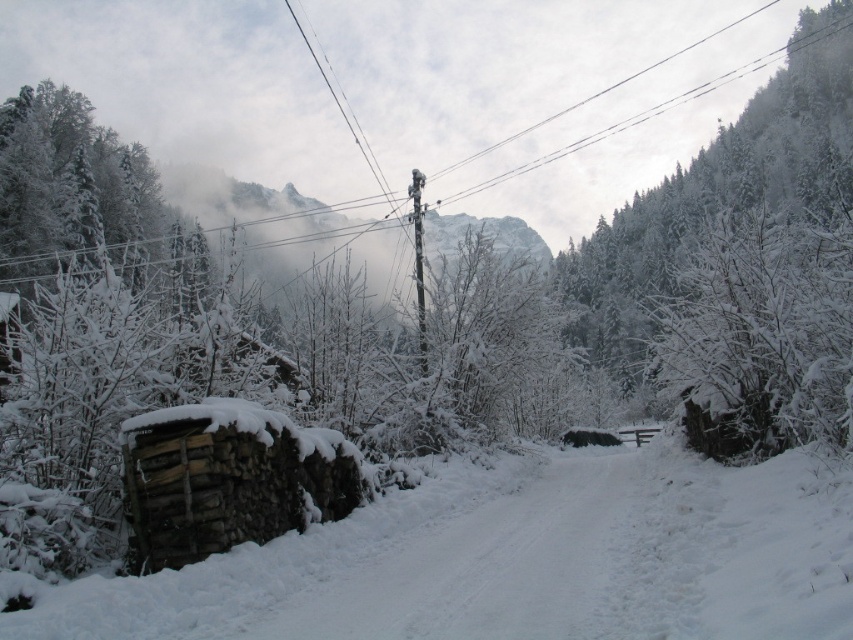
Question: In this image, where is white frosty tree at right located relative to white frosty trees at left?

Choices:
 (A) right
 (B) left

Answer: (A)

Question: Which of these objects is positioned farthest from the snow-covered evergreen at upper center?

Choices:
 (A) white frosty tree at right
 (B) white frosty trees at left

Answer: (B)

Question: Is white frosty tree at right below snow-covered evergreen at upper center?

Choices:
 (A) no
 (B) yes

Answer: (B)

Question: Which of the following is the closest to the observer?

Choices:
 (A) (788, 432)
 (B) (68, 92)
 (C) (614, 362)

Answer: (A)

Question: Is white frosty tree at right thinner than snow-covered evergreen at upper center?

Choices:
 (A) no
 (B) yes

Answer: (B)

Question: Which point is closer to the camera?

Choices:
 (A) white frosty tree at right
 (B) white frosty trees at left

Answer: (A)